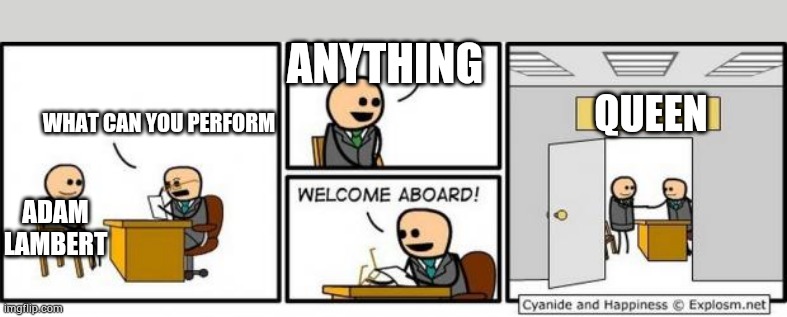
The width and height of the screenshot is (787, 317). I want to click on office desk, so click(148, 252), click(667, 236).